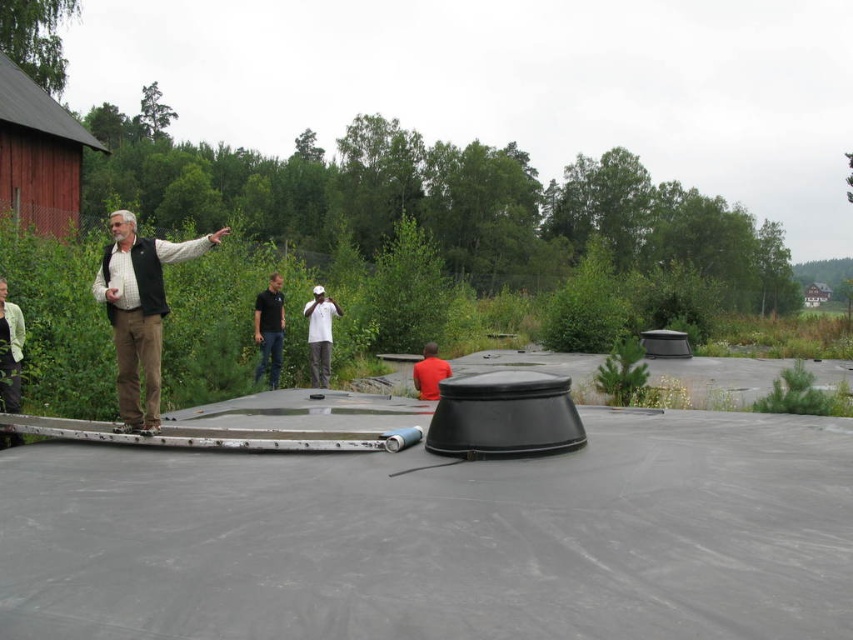
Is white matte baseball cap at center shorter than red matte shirt at center?

No.

Who is higher up, white matte baseball cap at center or red matte shirt at center?

white matte baseball cap at center is above.

Which is in front, point (323, 332) or point (426, 364)?

Point (426, 364) is more forward.

Identify the location of white matte baseball cap at center. Image resolution: width=853 pixels, height=640 pixels. (320, 333).

Is point (270, 333) positioned after point (309, 362)?

That is False.

The height and width of the screenshot is (640, 853). I want to click on dark blue shirt at center, so click(x=270, y=330).

The width and height of the screenshot is (853, 640). Identify the location of dark blue shirt at center. (270, 330).

Which is above, light brown vest at center or red matte shirt at center?

light brown vest at center is higher up.

Does light brown vest at center appear over red matte shirt at center?

Correct, light brown vest at center is located above red matte shirt at center.

Which is behind, point (142, 298) or point (434, 356)?

Positioned behind is point (434, 356).

Locate an element on the screen. light brown vest at center is located at coordinates (138, 310).